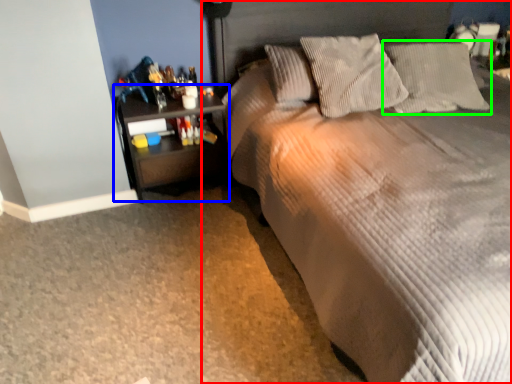
Question: Which is farther away from bed (highlighted by a red box)? nightstand (highlighted by a blue box) or pillow (highlighted by a green box)?

Choices:
 (A) nightstand
 (B) pillow

Answer: (A)